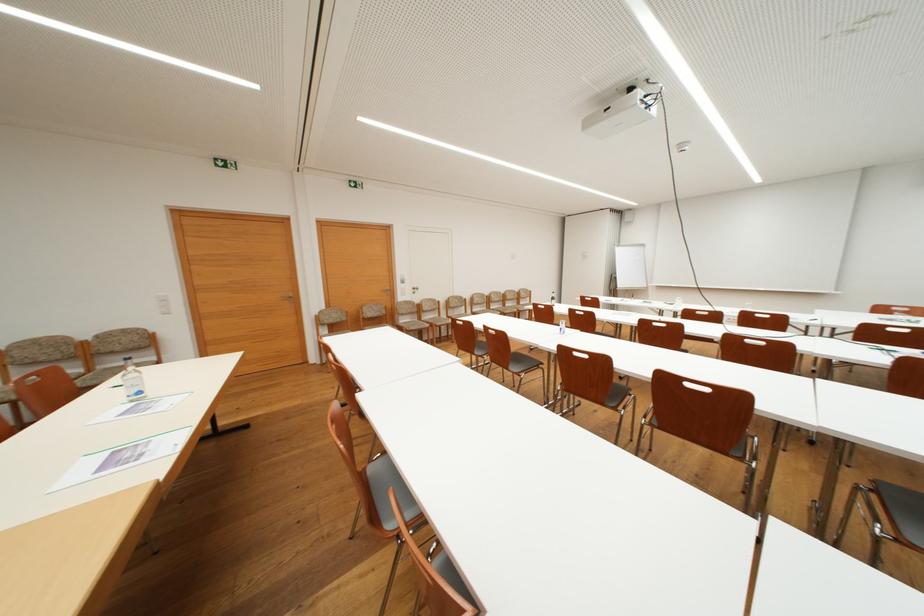
At what (x,y) coordinates should I click in order to perform the action: click on plastic water bottle. Please return your answer as a coordinate pair (x, y). The width and height of the screenshot is (924, 616). Looking at the image, I should click on (131, 381).